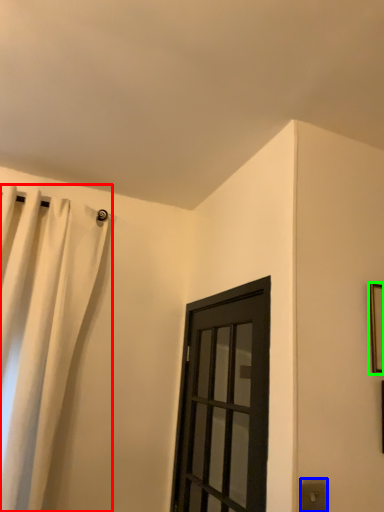
Question: Based on their relative distances, which object is nearer to curtain (highlighted by a red box)? Choose from electric outlet (highlighted by a blue box) and picture frame (highlighted by a green box).

Choices:
 (A) electric outlet
 (B) picture frame

Answer: (A)